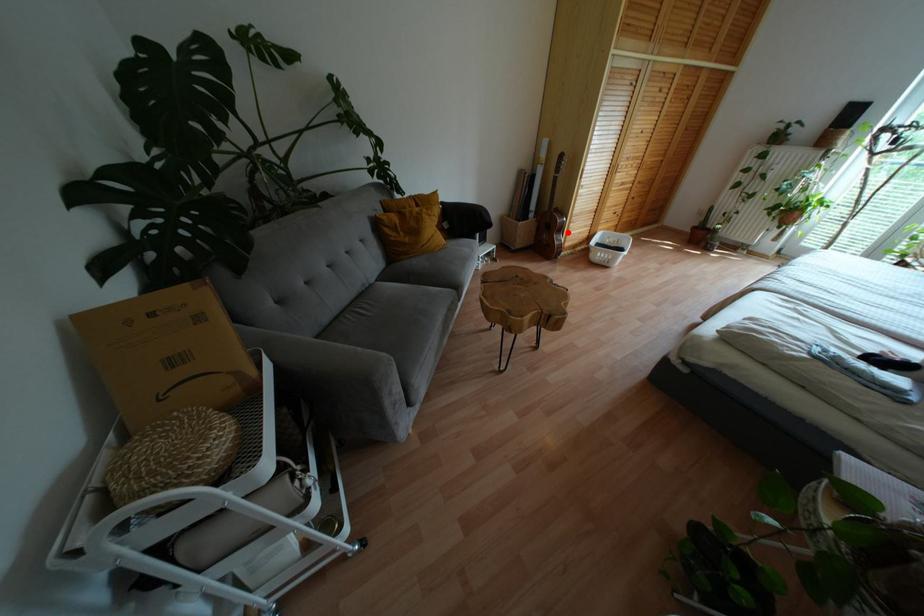
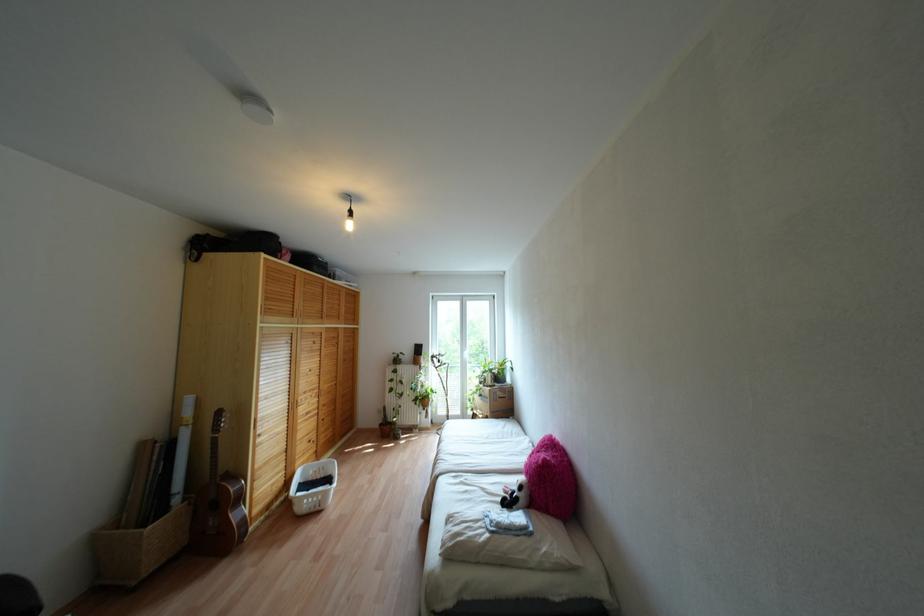
Question: I am providing you with two images of the same scene from different viewpoints. A red point is shown in image1. For the corresponding object point in image2, is it positioned nearer or farther from the camera?

Choices:
 (A) Nearer
 (B) Farther

Answer: (B)